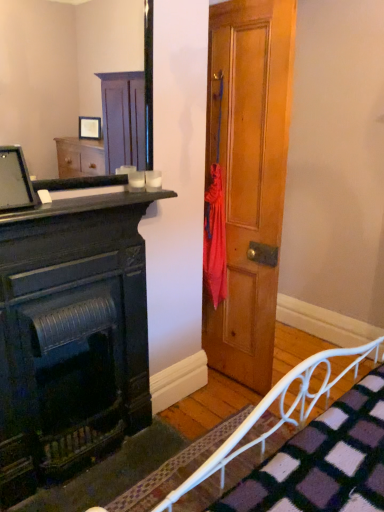
Where is `free space above matte black fireplace at left (from a real-world perspective)`? free space above matte black fireplace at left (from a real-world perspective) is located at coordinates (77, 208).